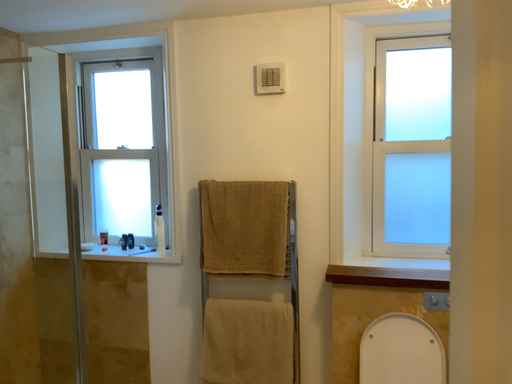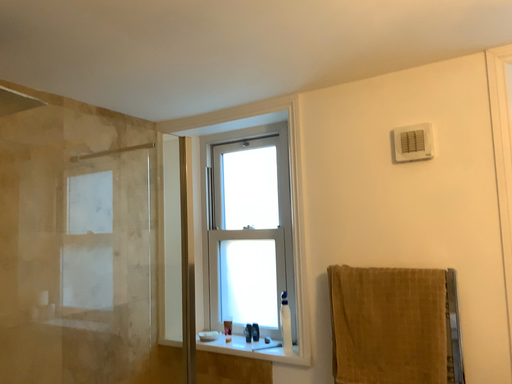
Question: How did the camera likely rotate when shooting the video?

Choices:
 (A) rotated downward
 (B) rotated upward

Answer: (B)